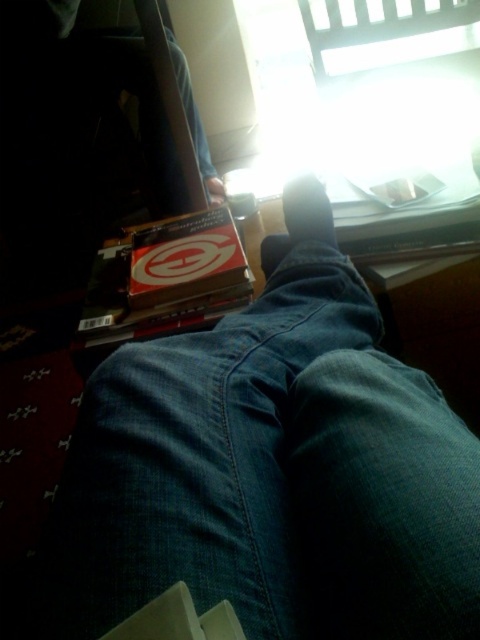
Question: Does matte black shoe at center have a smaller size compared to matte black foot at lower center?

Choices:
 (A) no
 (B) yes

Answer: (A)

Question: Which of these objects is positioned closest to the matte black shoe at center?

Choices:
 (A) matte black foot at lower center
 (B) dark blue denim jeans at center

Answer: (B)

Question: Which of the following is the farthest from the observer?

Choices:
 (A) (331, 209)
 (B) (295, 406)
 (C) (217, 186)

Answer: (C)

Question: Does dark blue denim jeans at center appear on the left side of matte black foot at lower center?

Choices:
 (A) no
 (B) yes

Answer: (A)

Question: Considering the real-world distances, which object is farthest from the matte black shoe at center?

Choices:
 (A) dark blue denim jeans at center
 (B) matte black foot at lower center

Answer: (B)

Question: Does dark blue denim jeans at center have a lesser width compared to matte black foot at lower center?

Choices:
 (A) no
 (B) yes

Answer: (A)